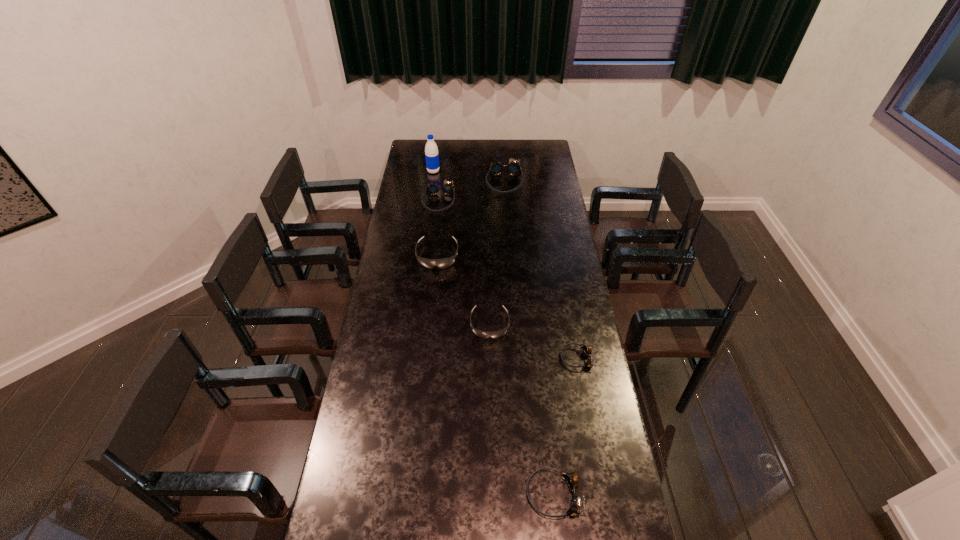
The image size is (960, 540). In order to click on the tallest object in this screenshot , I will do `click(431, 150)`.

Where is `water bottle`? water bottle is located at coordinates (431, 150).

This screenshot has height=540, width=960. I want to click on the biggest bronze goggles, so click(x=513, y=168).

Locate an element on the screen. the second tallest object is located at coordinates (513, 168).

At what (x,y) coordinates should I click in order to perform the action: click on the leftmost bronze goggles. Please return your answer as a coordinate pair (x, y). The height and width of the screenshot is (540, 960). Looking at the image, I should click on click(x=432, y=189).

Find the location of `the fourth nearest goggles`. the fourth nearest goggles is located at coordinates (443, 263).

Find the location of `the left black goggles`. the left black goggles is located at coordinates (443, 263).

Locate an element on the screen. The image size is (960, 540). the third biggest bronze goggles is located at coordinates (571, 479).

Locate an element on the screen. The image size is (960, 540). the nearest bronze goggles is located at coordinates (571, 479).

Locate an element on the screen. Image resolution: width=960 pixels, height=540 pixels. the fourth farthest goggles is located at coordinates (482, 334).